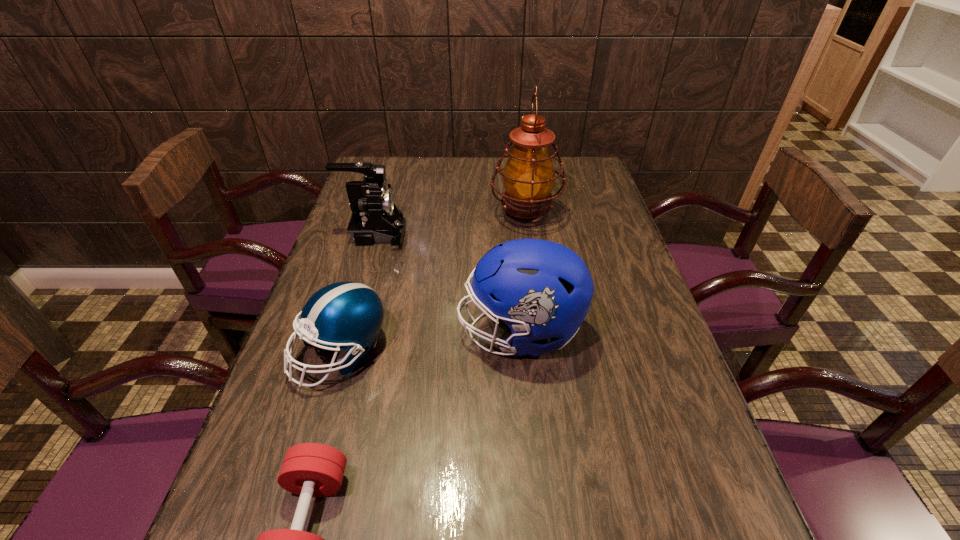
What are the coordinates of `free space located at the front of the left football helmet with the faceguard` in the screenshot? It's located at (286, 539).

Locate an element on the screen. This screenshot has height=540, width=960. camcorder at the left edge is located at coordinates (375, 218).

At what (x,y) coordinates should I click in order to perform the action: click on football helmet that is at the left edge. Please return your answer as a coordinate pair (x, y). Looking at the image, I should click on coord(348,315).

Where is `vacant space at the far edge`? The width and height of the screenshot is (960, 540). vacant space at the far edge is located at coordinates (502, 167).

I want to click on free location at the left edge of the desktop, so click(x=271, y=467).

This screenshot has width=960, height=540. Identify the location of free region at the right edge. (584, 205).

In the image, there is a desktop. Identify the location of free space at the far right corner. (596, 184).

Where is `vacant area that lies between the oil lamp and the camcorder`? This screenshot has width=960, height=540. vacant area that lies between the oil lamp and the camcorder is located at coordinates (450, 225).

Where is `empty space between the tallest object and the shorter football helmet`? empty space between the tallest object and the shorter football helmet is located at coordinates (433, 284).

Locate an element on the screen. the closest object relative to the taller football helmet is located at coordinates (348, 315).